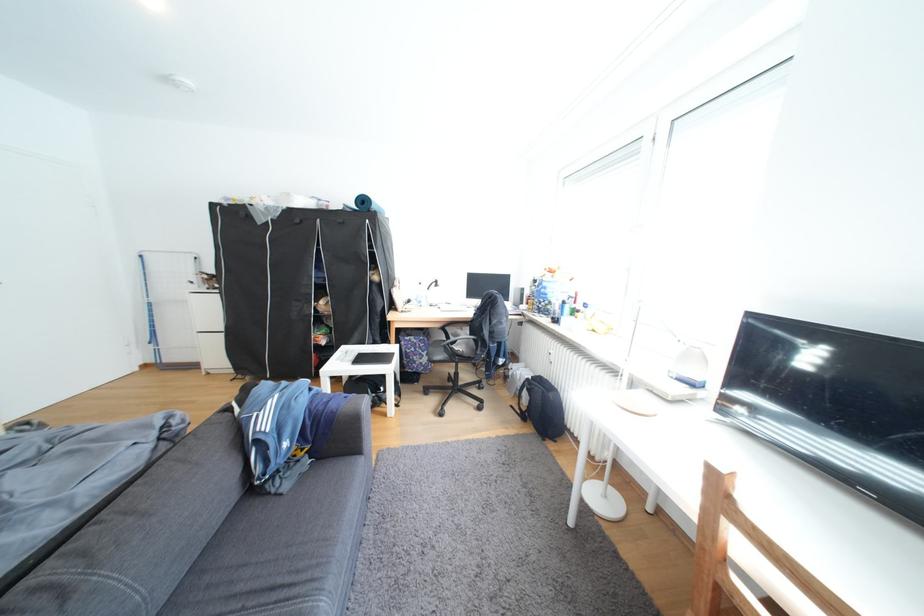
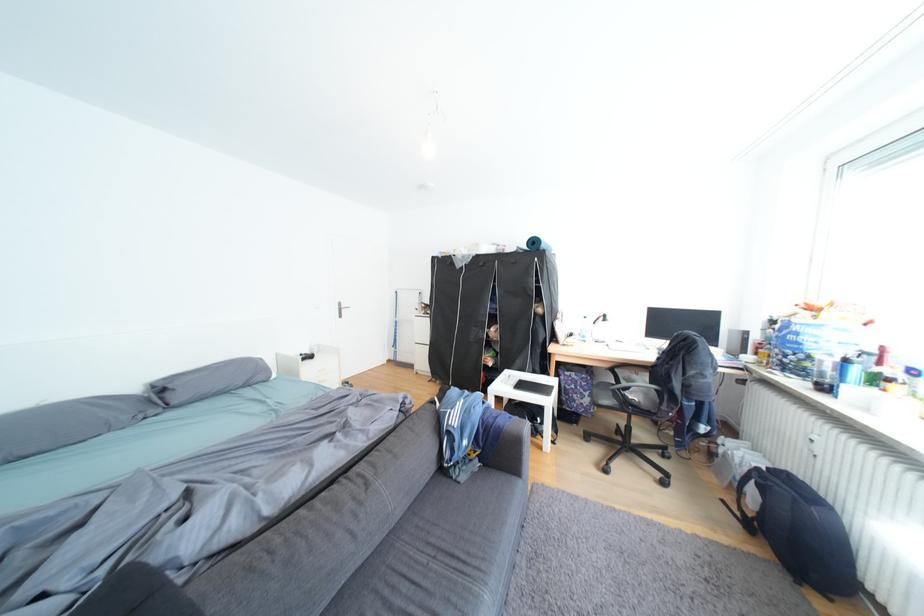
Find the pixel in the second image that matches [582,299] in the first image.

(878, 355)